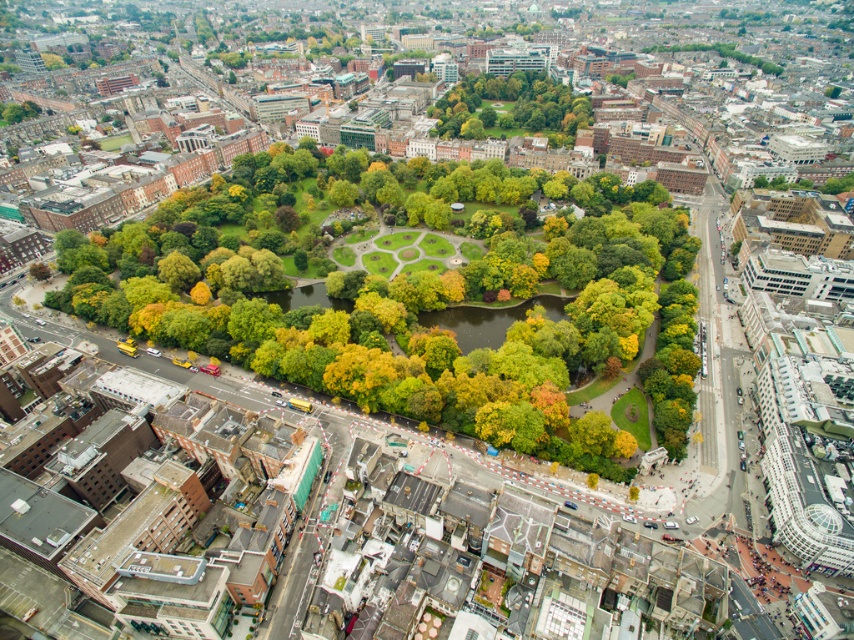
Question: Can you confirm if green leafy tree at center is smaller than green leafy tree at upper right?

Choices:
 (A) no
 (B) yes

Answer: (A)

Question: Is green leafy trees at center to the right of green leafy tree at upper right from the viewer's perspective?

Choices:
 (A) yes
 (B) no

Answer: (B)

Question: Does green leafy trees at center appear over green leafy tree at center?

Choices:
 (A) yes
 (B) no

Answer: (B)

Question: Based on their relative distances, which object is nearer to the green leafy tree at upper right?

Choices:
 (A) green leafy tree at center
 (B) green leafy trees at center

Answer: (A)

Question: Estimate the real-world distances between objects in this image. Which object is closer to the green leafy tree at center?

Choices:
 (A) green leafy trees at center
 (B) green leafy tree at upper right

Answer: (A)

Question: Estimate the real-world distances between objects in this image. Which object is closer to the green leafy tree at upper right?

Choices:
 (A) green leafy tree at center
 (B) green leafy trees at center

Answer: (A)